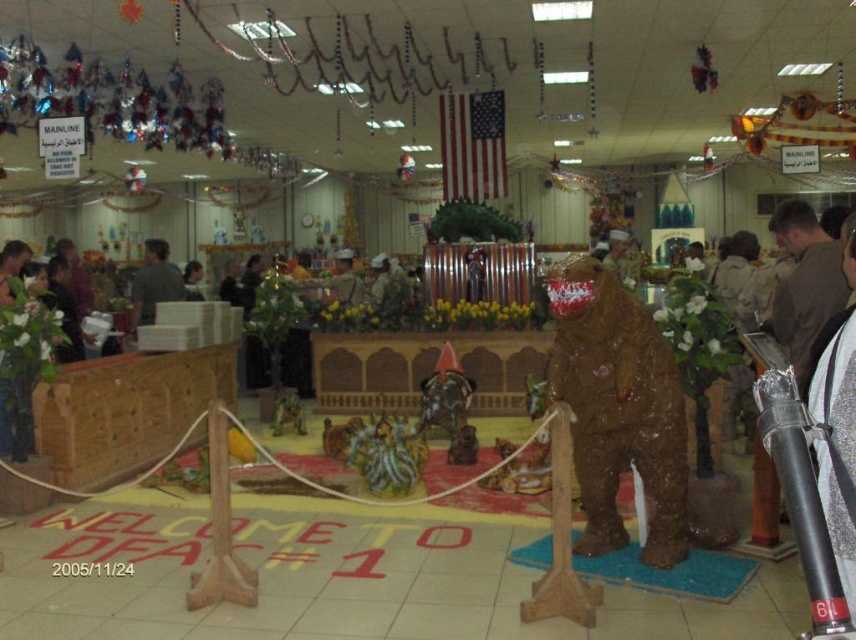
Between gray fabric shirt at center and matte brown bear at center, which one is positioned higher?

matte brown bear at center is higher up.

Is point (147, 324) farther from viewer compared to point (339, 252)?

No.

This screenshot has height=640, width=856. Describe the element at coordinates (153, 284) in the screenshot. I see `gray fabric shirt at center` at that location.

Where is `gray fabric shirt at center`? This screenshot has width=856, height=640. gray fabric shirt at center is located at coordinates (153, 284).